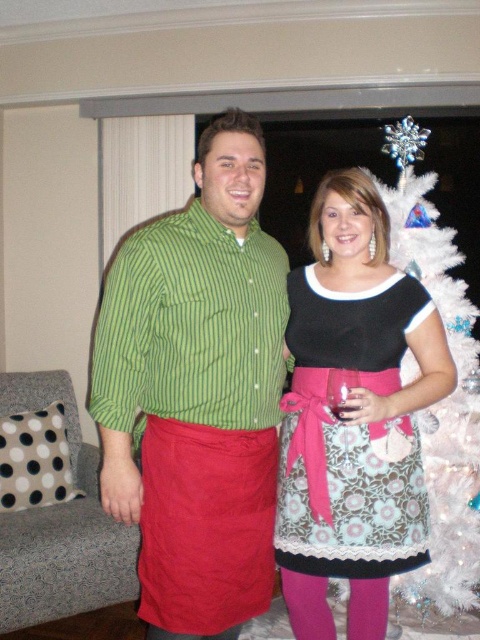
You are standing in a living room with a Christmas tree and want to hand a gift to the person wearing the matte green striped shirt at center. Can you reach them without moving closer?

The matte green striped shirt at center is 1.48 meters away from the viewer, so yes, you can reach them without moving closer as the typical reaching distance for an average person is around 1 meter.